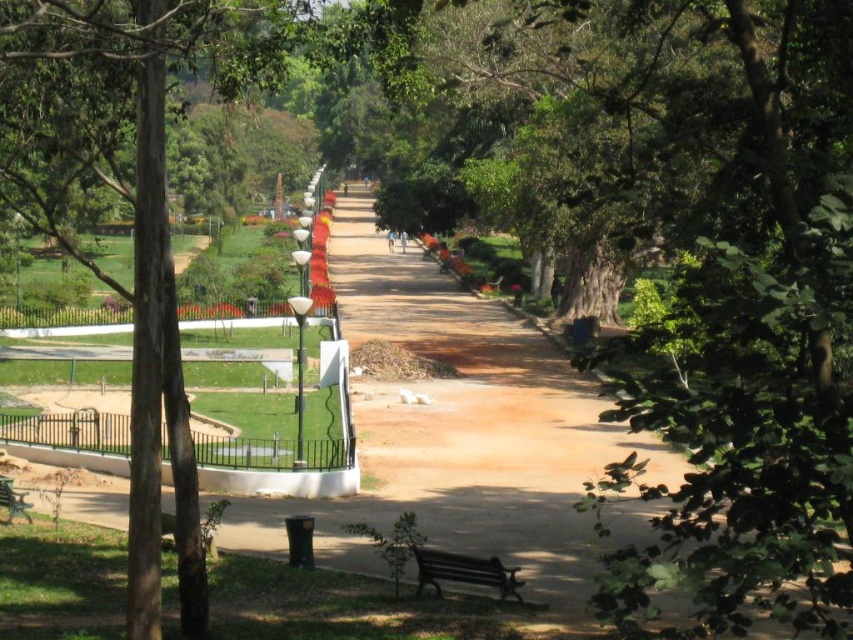
Question: Does brown wood tree at left have a greater width compared to wooden bench at lower center?

Choices:
 (A) yes
 (B) no

Answer: (A)

Question: Which point is closer to the camera taking this photo?

Choices:
 (A) (178, 362)
 (B) (30, 516)

Answer: (A)

Question: Does brown wood tree at left have a smaller size compared to green painted wood bench at lower left?

Choices:
 (A) no
 (B) yes

Answer: (A)

Question: Can you confirm if wooden bench at lower center is wider than green painted wood bench at lower left?

Choices:
 (A) no
 (B) yes

Answer: (B)

Question: Which of the following is the farthest from the observer?

Choices:
 (A) brown wood tree at left
 (B) wooden bench at lower center

Answer: (B)

Question: Which object is the closest to the brown wood tree at left?

Choices:
 (A) wooden bench at lower center
 (B) green painted wood bench at lower left

Answer: (A)